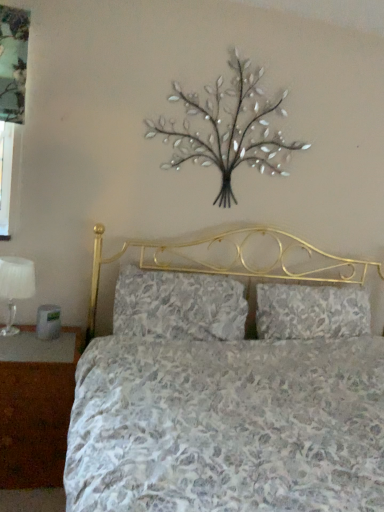
Image resolution: width=384 pixels, height=512 pixels. Identify the location of free area below white fabric lampshade at left (from a real-world perspective). pos(8,329).